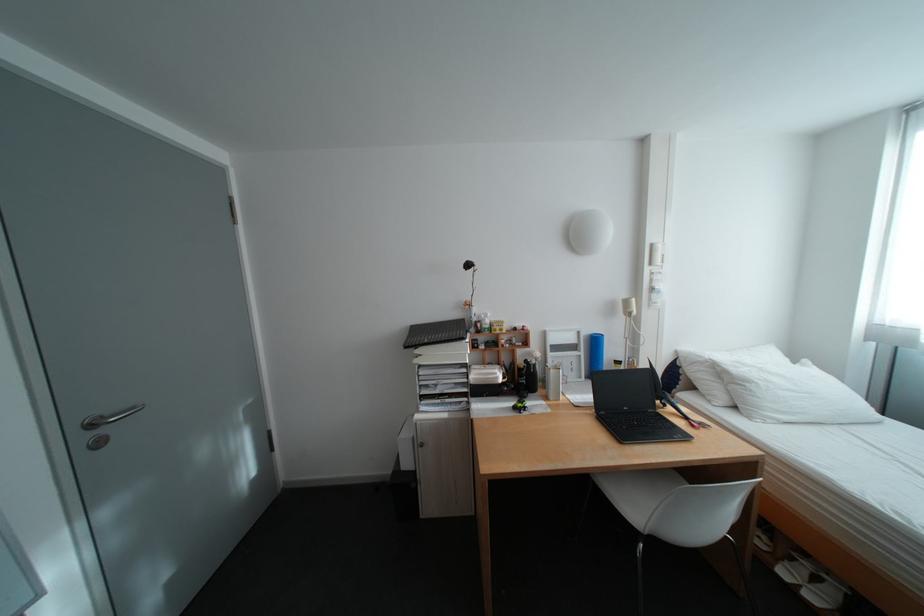
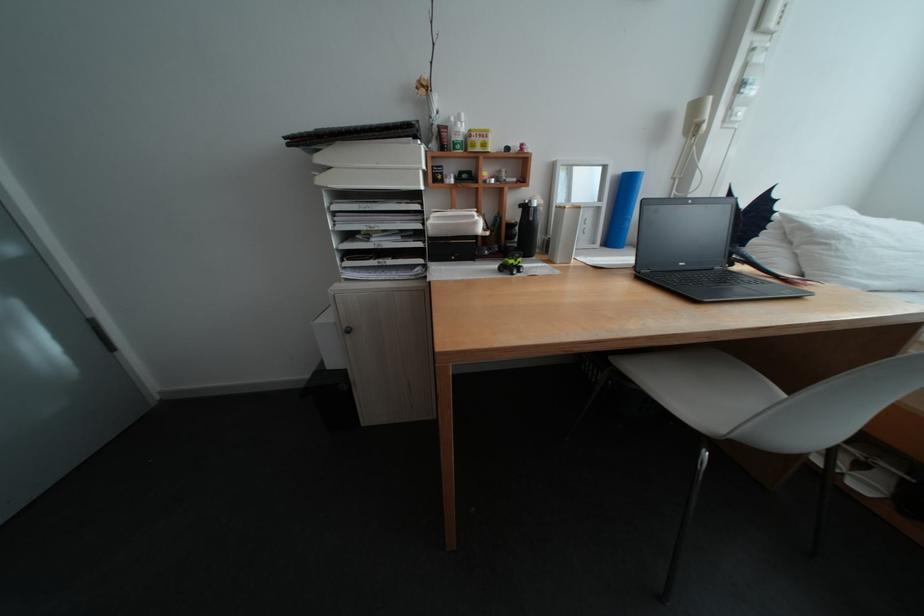
Question: The first image is from the beginning of the video and the second image is from the end. How did the camera likely rotate when shooting the video?

Choices:
 (A) Left
 (B) Right
 (C) Up
 (D) Down

Answer: (D)